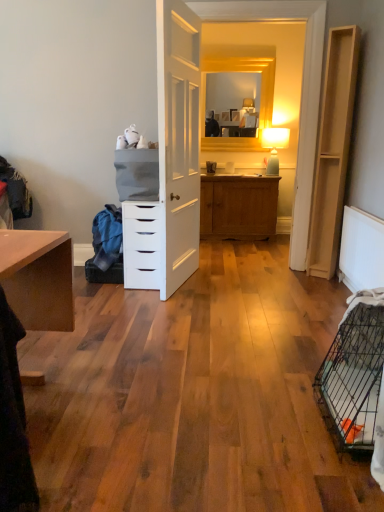
Question: Would you say white textured radiator at lower right is inside or outside white matte chest of drawers at center?

Choices:
 (A) inside
 (B) outside

Answer: (B)

Question: Considering the positions of white textured radiator at lower right and white matte chest of drawers at center in the image, is white textured radiator at lower right wider or thinner than white matte chest of drawers at center?

Choices:
 (A) wide
 (B) thin

Answer: (B)

Question: Which of these objects is positioned closest to the light wood/file cabinet at right?

Choices:
 (A) white textured radiator at lower right
 (B) blue fabric at left
 (C) black wire birdcage at lower right
 (D) white matte chest of drawers at center

Answer: (A)

Question: Which object is the closest to the light wood/file cabinet at right?

Choices:
 (A) blue fabric at left
 (B) white textured radiator at lower right
 (C) black wire birdcage at lower right
 (D) white matte chest of drawers at center

Answer: (B)